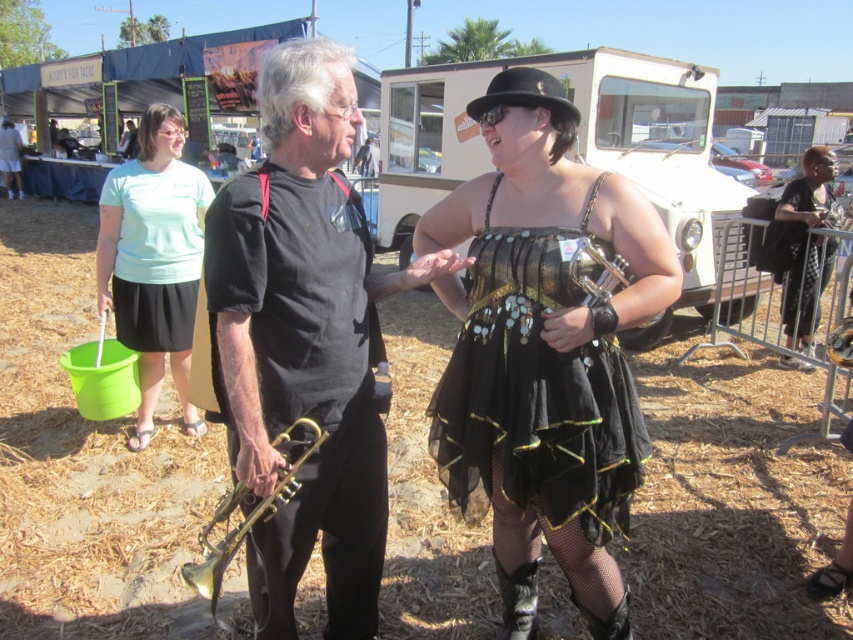
You are a photographer at the festival and want to capture a photo of the black sequined dress at right and the gold shiny trumpet at center. Which object should you zoom in more on to ensure it takes up more space in your photo?

The gold shiny trumpet at center should be zoomed in more because its width is greater than the black sequined dress at right.